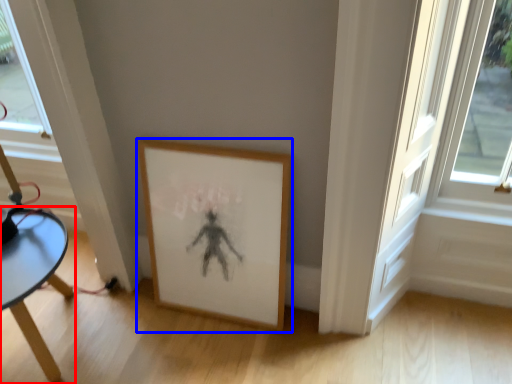
Question: Among these objects, which one is farthest to the camera, table (highlighted by a red box) or picture frame (highlighted by a blue box)?

Choices:
 (A) table
 (B) picture frame

Answer: (B)